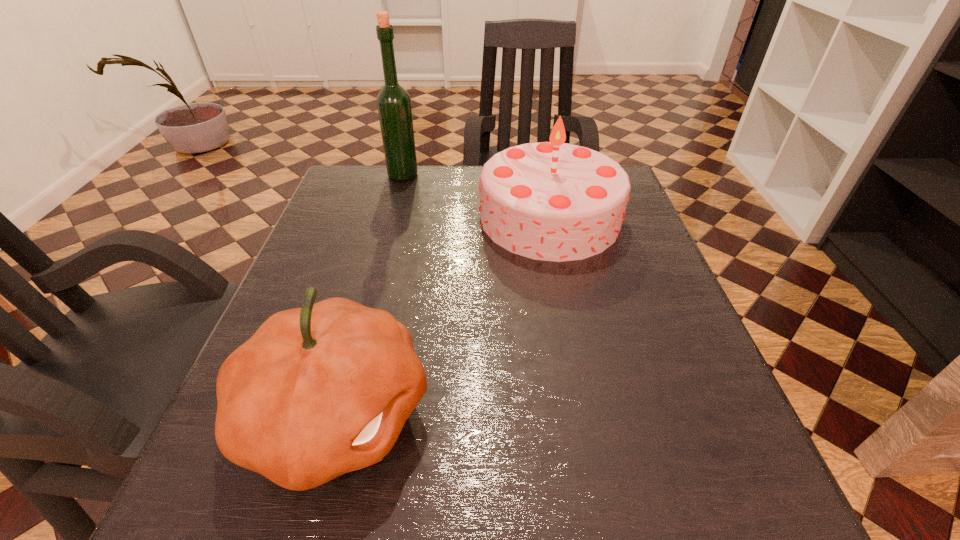
Find the location of `free spot between the pumpkin and the birthday cake`. free spot between the pumpkin and the birthday cake is located at coordinates (443, 315).

Where is `free space between the pumpkin and the rightmost object`? The height and width of the screenshot is (540, 960). free space between the pumpkin and the rightmost object is located at coordinates (443, 315).

Where is `vacant space in between the birthday cake and the liquor`? The width and height of the screenshot is (960, 540). vacant space in between the birthday cake and the liquor is located at coordinates (476, 196).

Where is `vacant space that is in between the shortest object and the tallest object`? vacant space that is in between the shortest object and the tallest object is located at coordinates click(370, 294).

I want to click on empty space that is in between the tallest object and the rightmost object, so click(x=476, y=196).

At what (x,y) coordinates should I click in order to perform the action: click on blank region between the tallest object and the rightmost object. Please return your answer as a coordinate pair (x, y). Image resolution: width=960 pixels, height=540 pixels. Looking at the image, I should click on (476, 196).

I want to click on empty location between the tallest object and the rightmost object, so click(x=476, y=196).

Where is `free area in between the rightmost object and the pumpkin`? The height and width of the screenshot is (540, 960). free area in between the rightmost object and the pumpkin is located at coordinates (443, 315).

You are a GUI agent. You are given a task and a screenshot of the screen. Output one action in this format:
    pyautogui.click(x=<x>, y=<y>)
    Task: Click on the vacant area that lies between the tallest object and the rightmost object
    
    Given the screenshot: What is the action you would take?
    pyautogui.click(x=476, y=196)

This screenshot has height=540, width=960. What are the coordinates of `vacant area that lies between the rightmost object and the shortest object` in the screenshot? It's located at (443, 315).